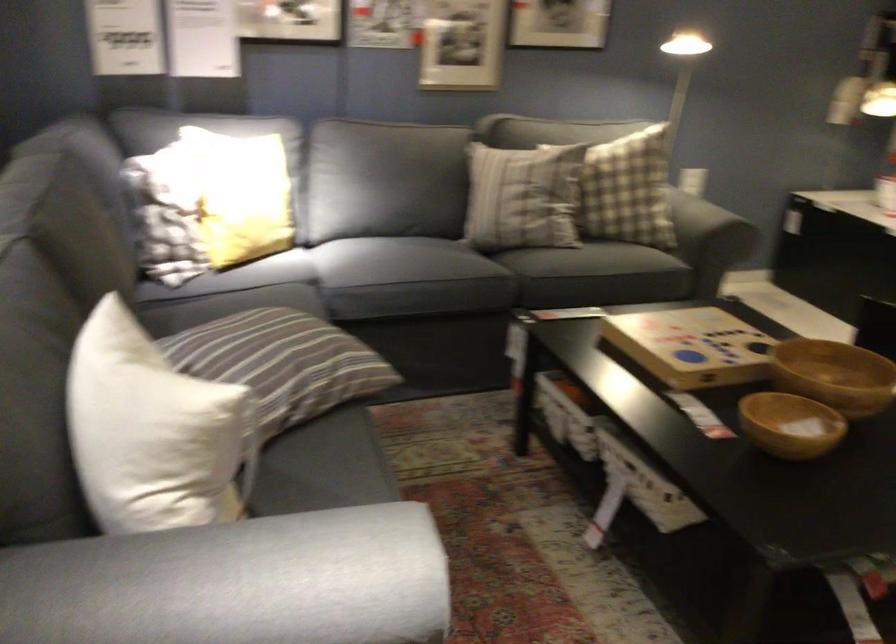
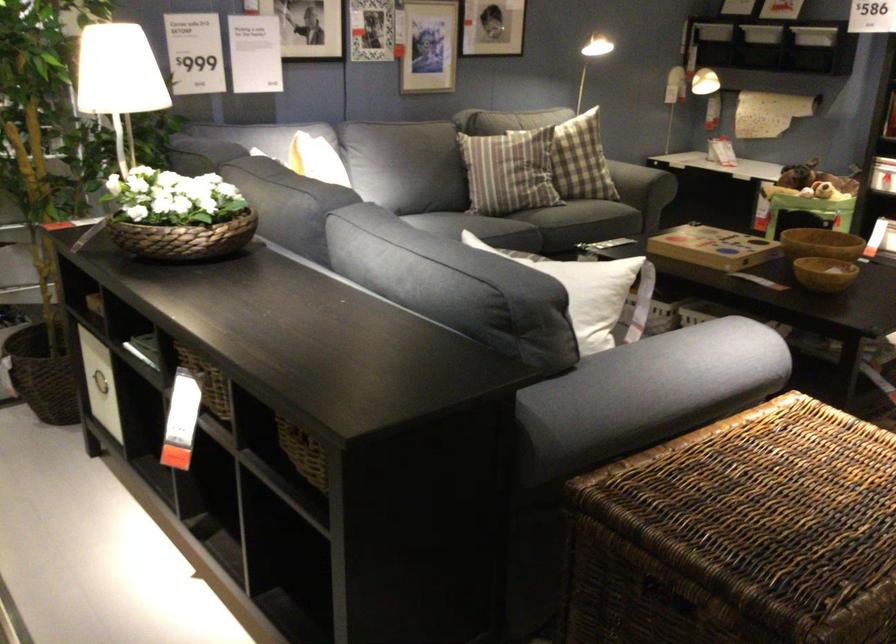
Find the pixel in the second image that matches (409,252) in the first image.

(484, 227)